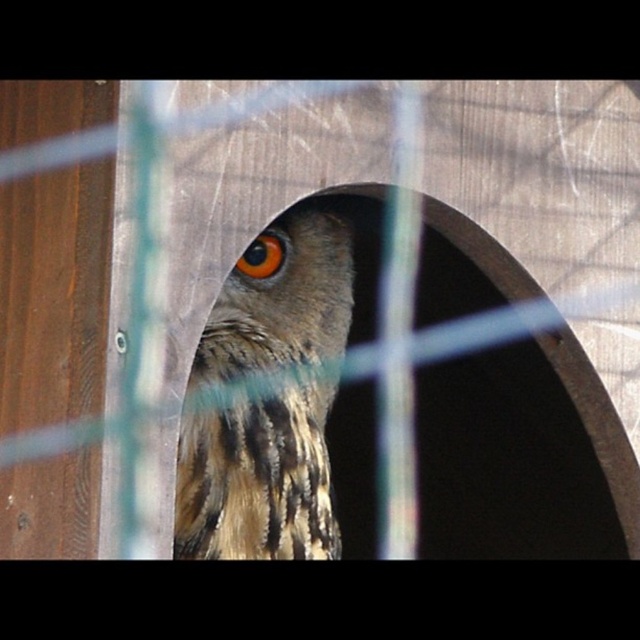
Who is positioned more to the right, brown speckled feathers at center or brown textured eye at center?

brown speckled feathers at center

This screenshot has height=640, width=640. What are the coordinates of `brown speckled feathers at center` in the screenshot? It's located at (257, 480).

Who is more forward, (294, 492) or (257, 259)?

Point (294, 492)

This screenshot has width=640, height=640. I want to click on brown speckled feathers at center, so click(257, 480).